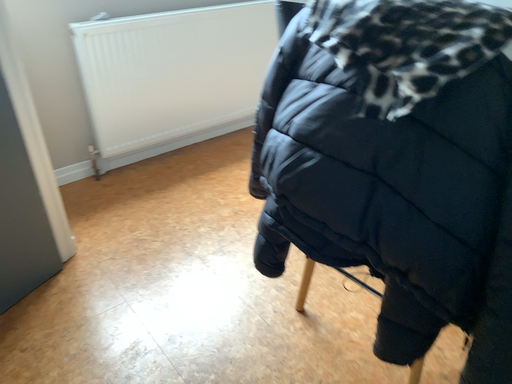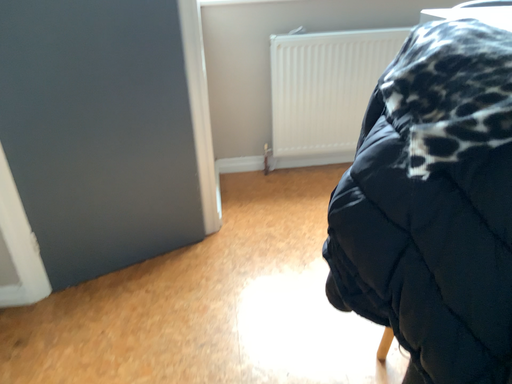
Question: How did the camera likely rotate when shooting the video?

Choices:
 (A) rotated right
 (B) rotated left

Answer: (B)